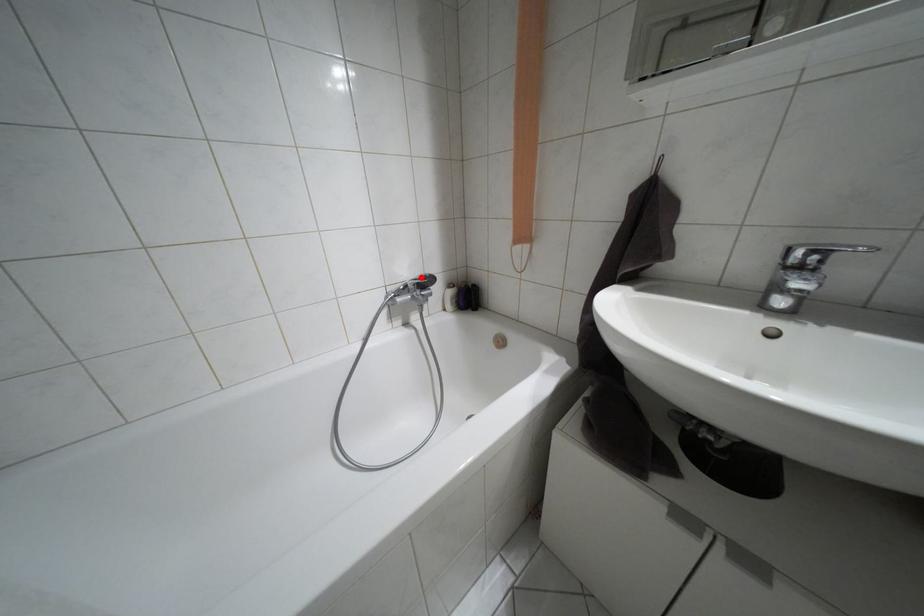
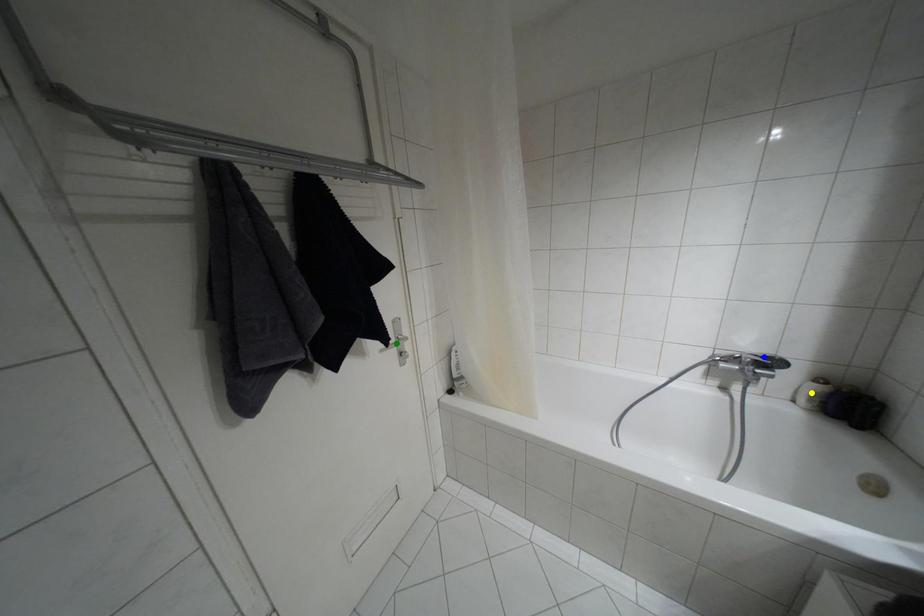
Question: I am providing you with two images of the same scene from different viewpoints. A red point is marked on the first image. You are given multiple points on the second image. Which spot in image 2 lines up with the point in image 1?

Choices:
 (A) blue point
 (B) yellow point
 (C) green point

Answer: (A)